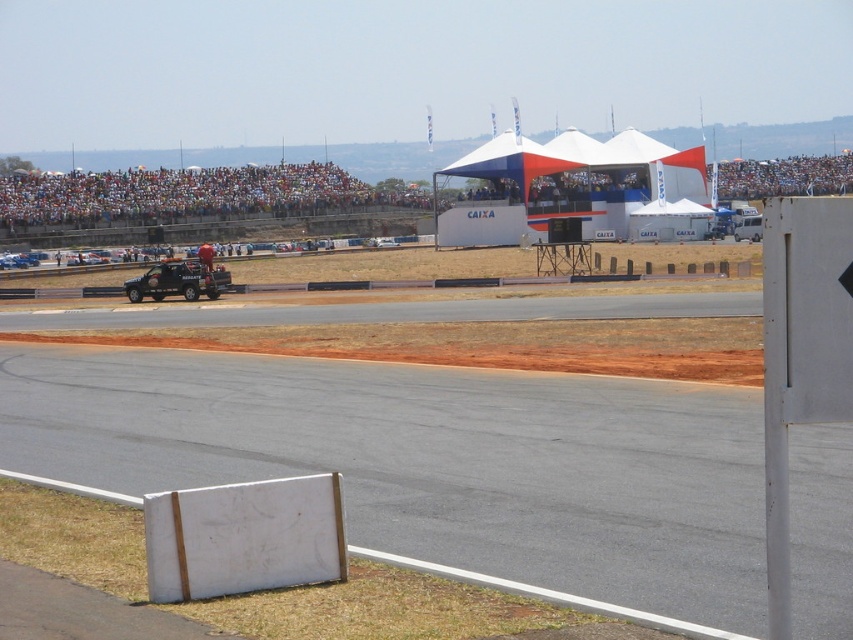
You are a photographer at the event and need to capture both the white smooth board at center and the multicolored fabric crowd at upper center in a single shot. Which object should you position closer to the edge of your camera frame to include both?

Since the white smooth board at center is narrower than the multicolored fabric crowd at upper center, you should position the white smooth board at center closer to the edge of your camera frame to ensure both fit within the shot.

Looking at this image, you are a drone operator tasked with capturing aerial footage of the white smooth board at center and the multicolored fabric crowd at upper center. Your drone can only fly within a 50 meter radius from its takeoff point. If you want to film both objects without moving the drone, where should you position the takeoff point?

The white smooth board at center and the multicolored fabric crowd at upper center are 72.30 meters apart. Since the drone can only fly within a 50 meter radius, the takeoff point must be placed somewhere between them so that both are within the 50 meter range. The midpoint between them would be 36.15 meters from each, which is within the 50 meter limit. Therefore, positioning the takeoff point midway between the white smooth board at center and the multicolored fabric crowd at upper center would allow the

You are a drone operator trying to capture aerial footage of the racing event. Your drone is currently hovering at point (190, 196). Based on the scene description, where is the drone positioned relative to the crowd?

The point (190, 196) is on the multicolored fabric crowd at upper center, so the drone is positioned directly above the crowd.